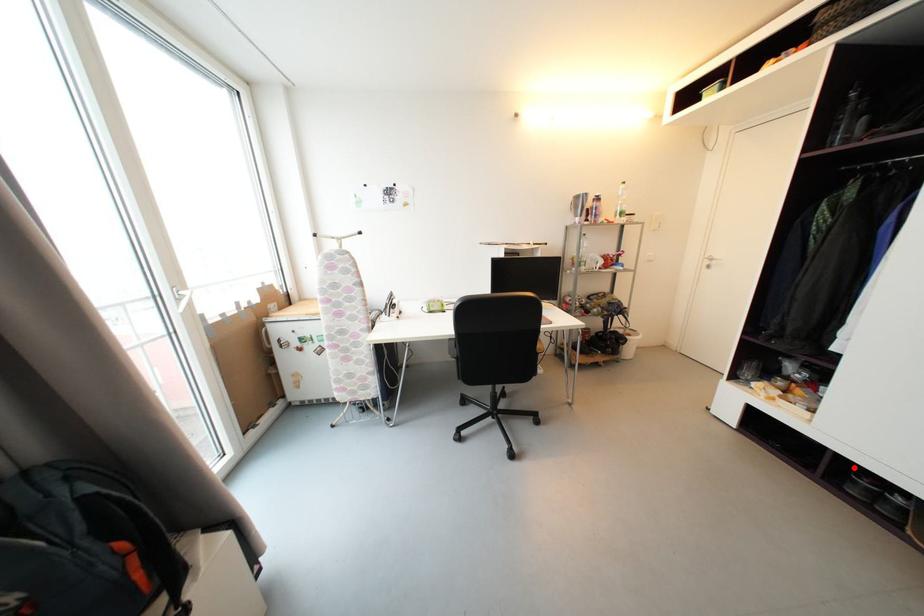
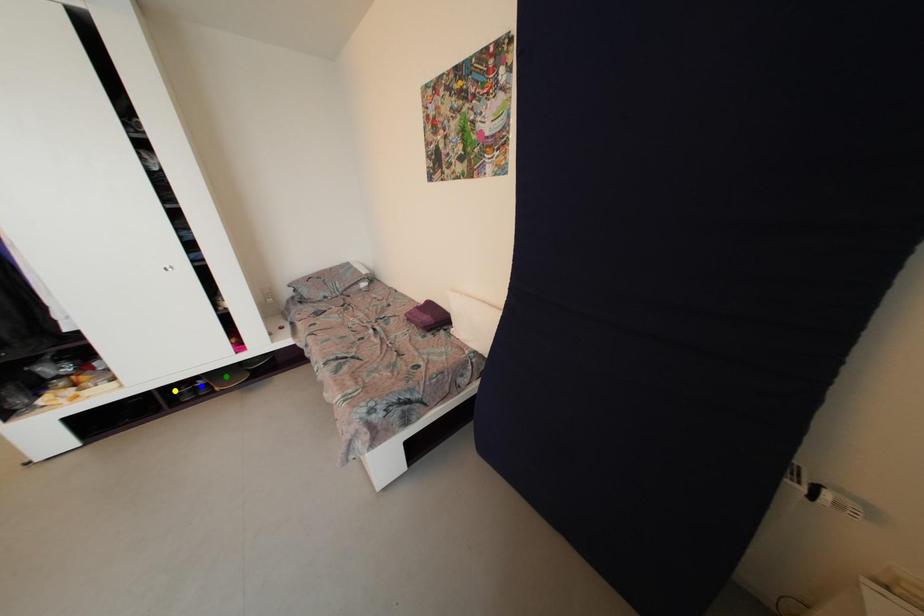
Question: I am providing you with two images of the same scene from different viewpoints. A red point is marked on the first image. You are given multiple points on the second image. In image 2, which mark is for the same physical point as the one in image 1?

Choices:
 (A) blue point
 (B) yellow point
 (C) green point

Answer: (B)